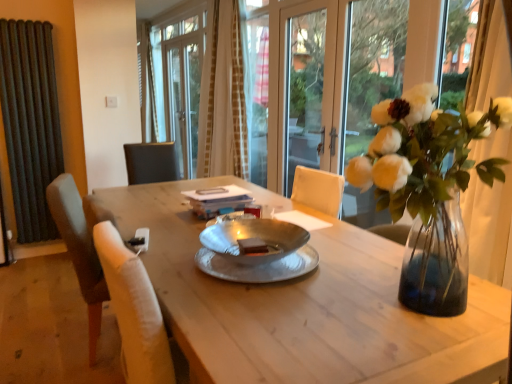
What are the coordinates of `empty space that is ontop of dark gray radiator at left (from a real-world perspective)` in the screenshot? It's located at (20, 13).